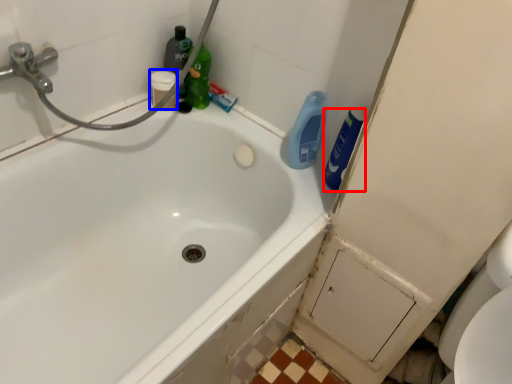
Question: Which object appears closest to the camera in this image, cleaning product (highlighted by a red box) or toiletry (highlighted by a blue box)?

Choices:
 (A) cleaning product
 (B) toiletry

Answer: (A)